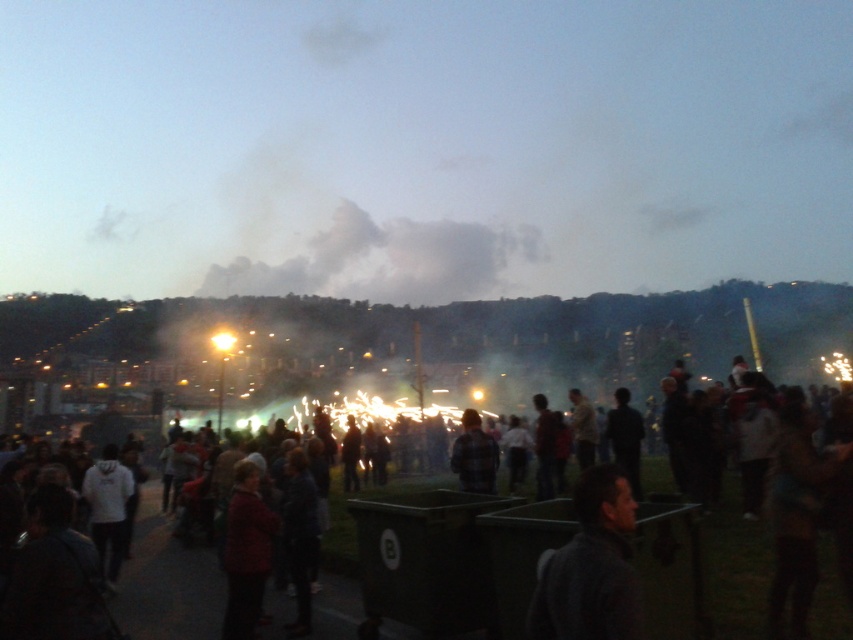
Question: Which point is closer to the camera?

Choices:
 (A) dark clothing crowd at center
 (B) dark gray fabric at center

Answer: (B)

Question: Is dark clothing crowd at center to the left of plaid fabric shirt at center from the viewer's perspective?

Choices:
 (A) no
 (B) yes

Answer: (A)

Question: Is dark clothing crowd at center further to camera compared to plaid fabric shirt at center?

Choices:
 (A) no
 (B) yes

Answer: (A)

Question: Is dark clothing crowd at center wider than dark gray fabric at center?

Choices:
 (A) yes
 (B) no

Answer: (A)

Question: Which of the following is the farthest from the observer?

Choices:
 (A) dark gray fabric at center
 (B) plaid fabric shirt at center

Answer: (B)

Question: Considering the real-world distances, which object is closest to the plaid fabric shirt at center?

Choices:
 (A) dark clothing crowd at center
 (B) dark gray fabric at center

Answer: (A)